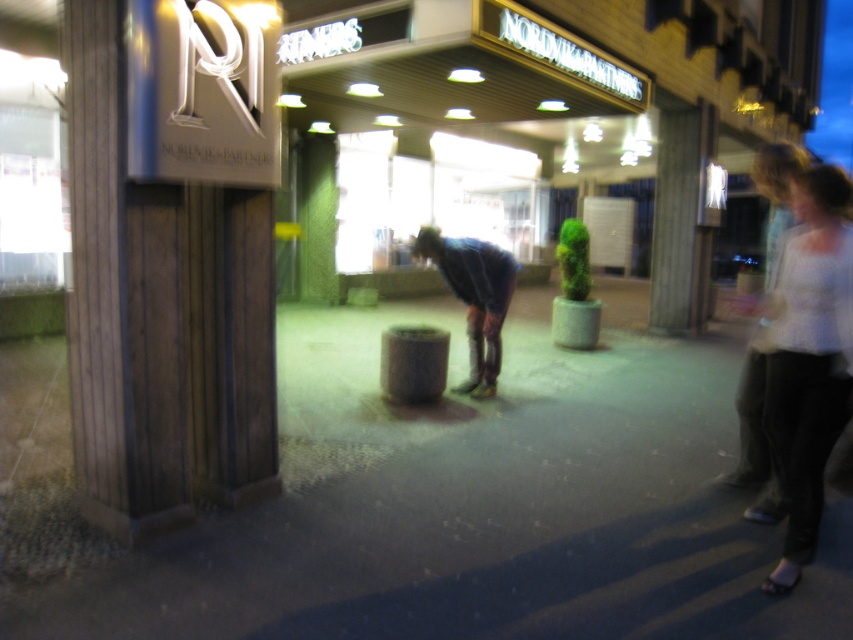
Question: Does wooden sign at left lie behind white knitwear at right?

Choices:
 (A) no
 (B) yes

Answer: (B)

Question: Can you confirm if smooth concrete pavement at center is positioned below wooden sign at left?

Choices:
 (A) no
 (B) yes

Answer: (B)

Question: Can you confirm if smooth concrete pavement at center is positioned to the right of blue denim jeans at center?

Choices:
 (A) yes
 (B) no

Answer: (B)

Question: Estimate the real-world distances between objects in this image. Which object is closer to the white knitwear at right?

Choices:
 (A) blue denim jeans at center
 (B) wooden sign at left
 (C) smooth concrete pavement at center
 (D) wooden pillar at center

Answer: (B)

Question: Which of these objects is positioned farthest from the blue denim jeans at center?

Choices:
 (A) wooden pillar at center
 (B) wooden sign at left
 (C) smooth concrete pavement at center
 (D) white knitwear at right

Answer: (A)

Question: Which of the following is the closest to the observer?

Choices:
 (A) (538, 500)
 (B) (767, 582)
 (C) (662, 211)

Answer: (B)